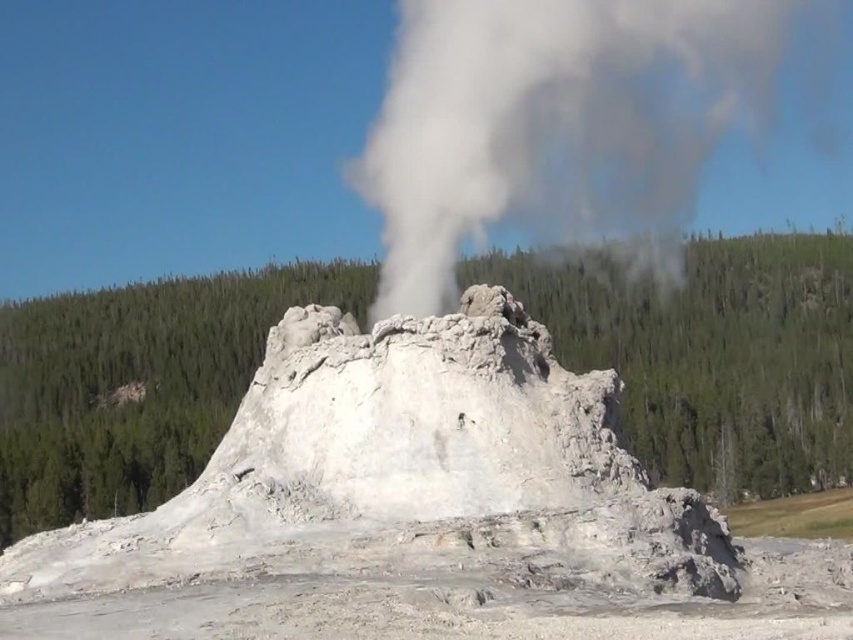
You are standing at the base of the geyser and notice two points marked in the image. Which of the two points, point (172,548) or point (709,38), is closer to you?

Point (172,548) is closer to the viewer than point (709,38).

Based on the provided coordinates, where is the white rocky geyser at center located in the image?

The white rocky geyser at center is located at coordinates point (405, 468).

You are a geologist observing the white rocky geyser at center and the white vapor at center. Which object is positioned lower in the image?

The white rocky geyser at center is located below the white vapor at center, so it is positioned lower in the image.